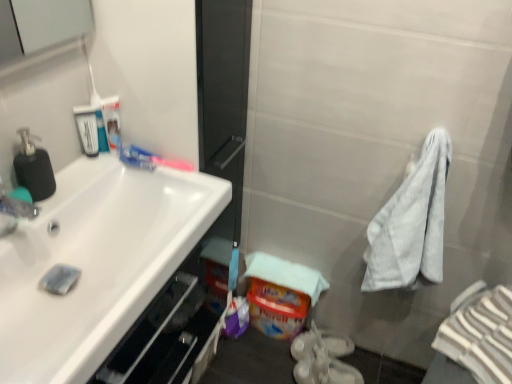
Question: Does white plastic mouthwash at upper left, acting as the 1th mouthwash starting from the left, have a larger size compared to matte black soap dispenser at left?

Choices:
 (A) no
 (B) yes

Answer: (A)

Question: Is white plastic mouthwash at upper left, acting as the 1th mouthwash starting from the left, to the left of matte black soap dispenser at left from the viewer's perspective?

Choices:
 (A) yes
 (B) no

Answer: (B)

Question: Is white plastic mouthwash at upper left, acting as the 1th mouthwash starting from the left, closer to the viewer compared to matte black soap dispenser at left?

Choices:
 (A) yes
 (B) no

Answer: (B)

Question: Is white plastic mouthwash at upper left, acting as the 1th mouthwash starting from the left, taller than matte black soap dispenser at left?

Choices:
 (A) no
 (B) yes

Answer: (A)

Question: From a real-world perspective, is white plastic mouthwash at upper left, marked as the 2th mouthwash in a right-to-left arrangement, below matte black soap dispenser at left?

Choices:
 (A) yes
 (B) no

Answer: (A)

Question: Is white plastic mouthwash at upper left, marked as the 2th mouthwash in a right-to-left arrangement, outside matte black soap dispenser at left?

Choices:
 (A) yes
 (B) no

Answer: (A)

Question: Considering the relative positions of matte black soap dispenser at left and clear plastic bottle at upper left, which is the first mouthwash from right to left, in the image provided, is matte black soap dispenser at left to the left of clear plastic bottle at upper left, which is the first mouthwash from right to left, from the viewer's perspective?

Choices:
 (A) yes
 (B) no

Answer: (A)

Question: Does matte black soap dispenser at left contain clear plastic bottle at upper left, marked as the second mouthwash in a left-to-right arrangement?

Choices:
 (A) no
 (B) yes

Answer: (A)

Question: Considering the relative sizes of matte black soap dispenser at left and clear plastic bottle at upper left, which is the first mouthwash from right to left, in the image provided, is matte black soap dispenser at left shorter than clear plastic bottle at upper left, which is the first mouthwash from right to left,?

Choices:
 (A) no
 (B) yes

Answer: (A)

Question: From a real-world perspective, does matte black soap dispenser at left stand above clear plastic bottle at upper left, marked as the second mouthwash in a left-to-right arrangement?

Choices:
 (A) yes
 (B) no

Answer: (A)

Question: Considering the relative sizes of matte black soap dispenser at left and clear plastic bottle at upper left, which is the first mouthwash from right to left, in the image provided, is matte black soap dispenser at left taller than clear plastic bottle at upper left, which is the first mouthwash from right to left,?

Choices:
 (A) no
 (B) yes

Answer: (B)

Question: Is matte black soap dispenser at left looking in the opposite direction of clear plastic bottle at upper left, marked as the second mouthwash in a left-to-right arrangement?

Choices:
 (A) no
 (B) yes

Answer: (A)

Question: Is matte black soap dispenser at left touching white striped bath towel at right?

Choices:
 (A) yes
 (B) no

Answer: (B)